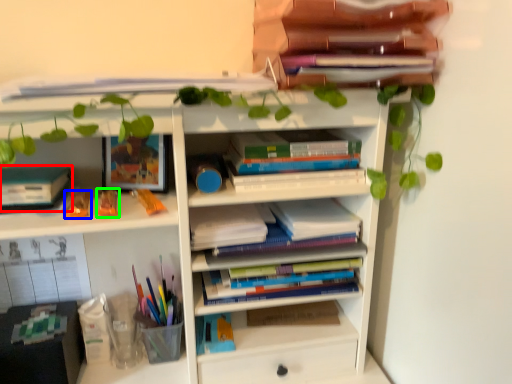
Question: Which object is positioned closest to paperback book (highlighted by a red box)? Select from toy (highlighted by a blue box) and toy (highlighted by a green box).

Choices:
 (A) toy
 (B) toy

Answer: (A)